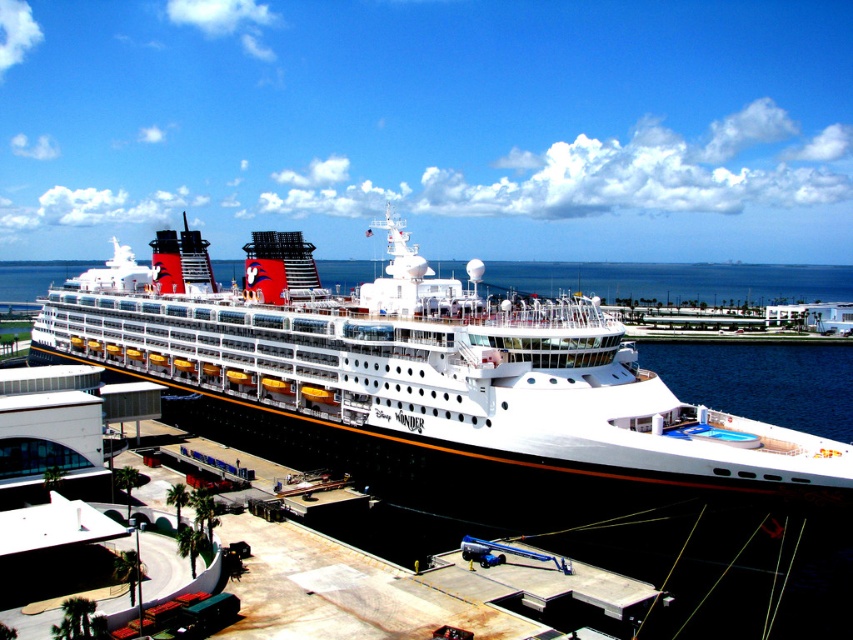
Can you confirm if white glossy cruise ship at center is smaller than blue water at center?

Actually, white glossy cruise ship at center might be larger than blue water at center.

Can you confirm if white glossy cruise ship at center is bigger than blue water at center?

Indeed, white glossy cruise ship at center has a larger size compared to blue water at center.

Is point (467, 429) positioned in front of point (688, 266)?

That is True.

Find the location of a particular element. white glossy cruise ship at center is located at coordinates (421, 381).